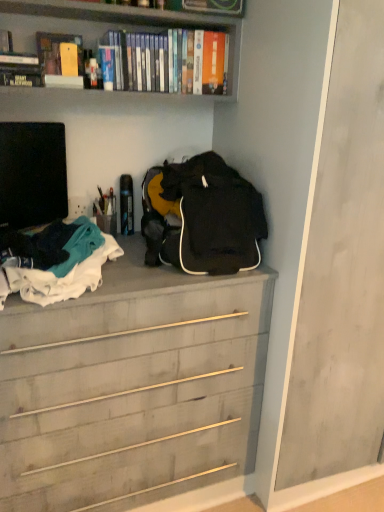
Question: Is black matte television at left looking in the opposite direction of wooden chest of drawers at center?

Choices:
 (A) no
 (B) yes

Answer: (A)

Question: Does black matte television at left lie behind wooden chest of drawers at center?

Choices:
 (A) no
 (B) yes

Answer: (B)

Question: Is black matte television at left at the left side of wooden chest of drawers at center?

Choices:
 (A) yes
 (B) no

Answer: (A)

Question: Does black matte television at left have a lesser height compared to wooden chest of drawers at center?

Choices:
 (A) yes
 (B) no

Answer: (A)

Question: Can you confirm if black matte television at left is positioned to the right of wooden chest of drawers at center?

Choices:
 (A) no
 (B) yes

Answer: (A)

Question: Would you say black matte television at left contains wooden chest of drawers at center?

Choices:
 (A) no
 (B) yes

Answer: (A)

Question: Is black matte television at left looking in the opposite direction of matte yellow book at upper left, placed as the 3th book when sorted from left to right?

Choices:
 (A) no
 (B) yes

Answer: (A)

Question: Is the position of black matte television at left more distant than that of matte yellow book at upper left, which is the 2th book in right-to-left order?

Choices:
 (A) no
 (B) yes

Answer: (A)

Question: Is black matte television at left bigger than matte yellow book at upper left, which is the 2th book in right-to-left order?

Choices:
 (A) yes
 (B) no

Answer: (A)

Question: From a real-world perspective, is black matte television at left positioned under matte yellow book at upper left, placed as the 3th book when sorted from left to right, based on gravity?

Choices:
 (A) no
 (B) yes

Answer: (B)

Question: Can you confirm if black matte television at left is positioned to the left of matte yellow book at upper left, placed as the 3th book when sorted from left to right?

Choices:
 (A) yes
 (B) no

Answer: (A)

Question: Is matte yellow book at upper left, placed as the 3th book when sorted from left to right, completely or partially inside black matte television at left?

Choices:
 (A) yes
 (B) no

Answer: (B)

Question: Is matte yellow book at upper left, placed as the 3th book when sorted from left to right, bigger than black matte television at left?

Choices:
 (A) yes
 (B) no

Answer: (B)